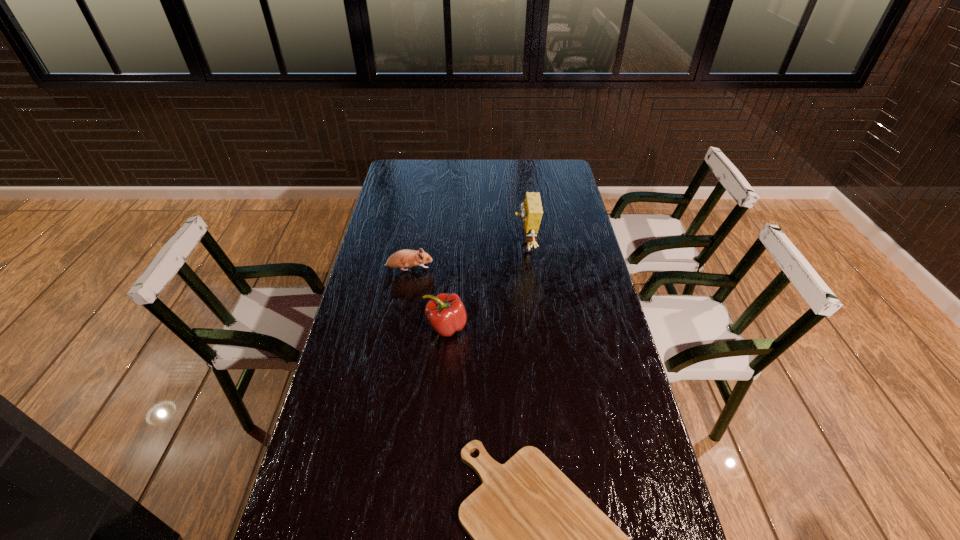
Where is `free space at the far edge of the desktop`? Image resolution: width=960 pixels, height=540 pixels. free space at the far edge of the desktop is located at coordinates (468, 183).

Locate an element on the screen. vacant position at the left edge of the desktop is located at coordinates (380, 354).

Image resolution: width=960 pixels, height=540 pixels. In the image, there is a desktop. In order to click on free region at the right edge in this screenshot , I will do `click(588, 262)`.

In the image, there is a desktop. Where is `vacant space at the far left corner`? vacant space at the far left corner is located at coordinates (396, 178).

You are a GUI agent. You are given a task and a screenshot of the screen. Output one action in this format:
    pyautogui.click(x=<x>, y=<y>)
    Task: Click on the free space that is in between the third tallest object and the third shortest object
    The width and height of the screenshot is (960, 540).
    Given the screenshot: What is the action you would take?
    pyautogui.click(x=427, y=298)

Image resolution: width=960 pixels, height=540 pixels. What are the coordinates of `vacant region between the third shortest object and the sponge` in the screenshot? It's located at (486, 287).

Find the location of `free space between the sponge and the second tallest object`. free space between the sponge and the second tallest object is located at coordinates (486, 287).

The height and width of the screenshot is (540, 960). Identify the location of vacant region between the pepper and the sponge. click(486, 287).

At what (x,y) coordinates should I click in order to perform the action: click on unoccupied position between the third tallest object and the tallest object. Please return your answer as a coordinate pair (x, y). Looking at the image, I should click on (467, 259).

Identify the location of vacant region between the third shortest object and the hamster. (427, 298).